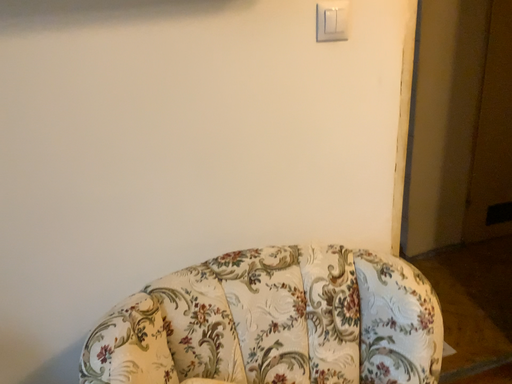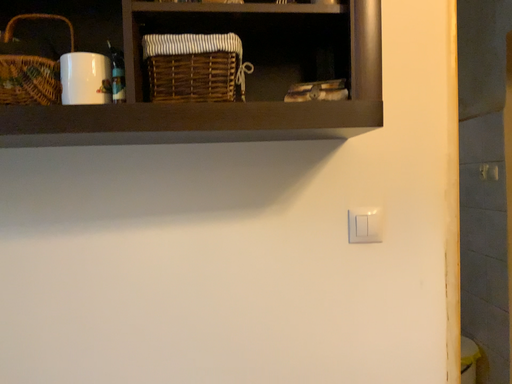
Question: Which way did the camera rotate in the video?

Choices:
 (A) rotated right
 (B) rotated left

Answer: (B)